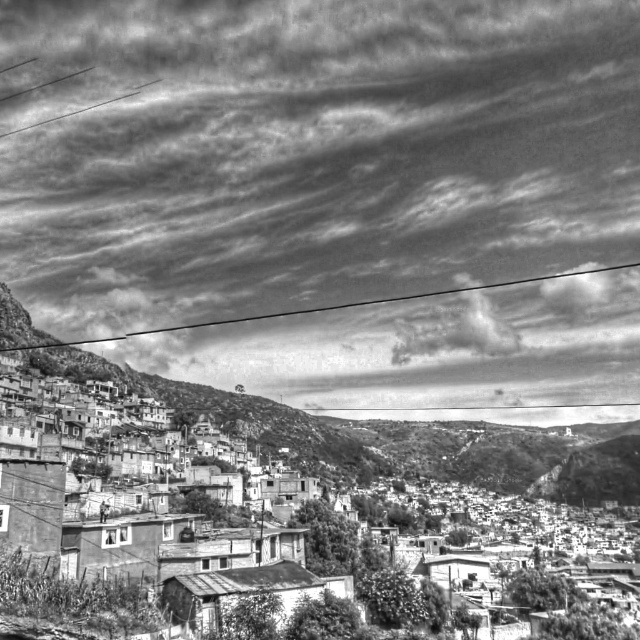
Question: Is grainy concrete houses at lower left positioned behind black wire at upper center?

Choices:
 (A) no
 (B) yes

Answer: (A)

Question: Is grainy concrete houses at lower left to the right of black wire at upper center from the viewer's perspective?

Choices:
 (A) yes
 (B) no

Answer: (A)

Question: Which of the following is the closest to the observer?

Choices:
 (A) grainy concrete houses at lower left
 (B) black wire at upper center

Answer: (A)

Question: Among these points, which one is farthest from the camera?

Choices:
 (A) (561, 275)
 (B) (557, 445)

Answer: (A)

Question: Can you confirm if grainy concrete houses at lower left is thinner than black wire at upper center?

Choices:
 (A) no
 (B) yes

Answer: (B)